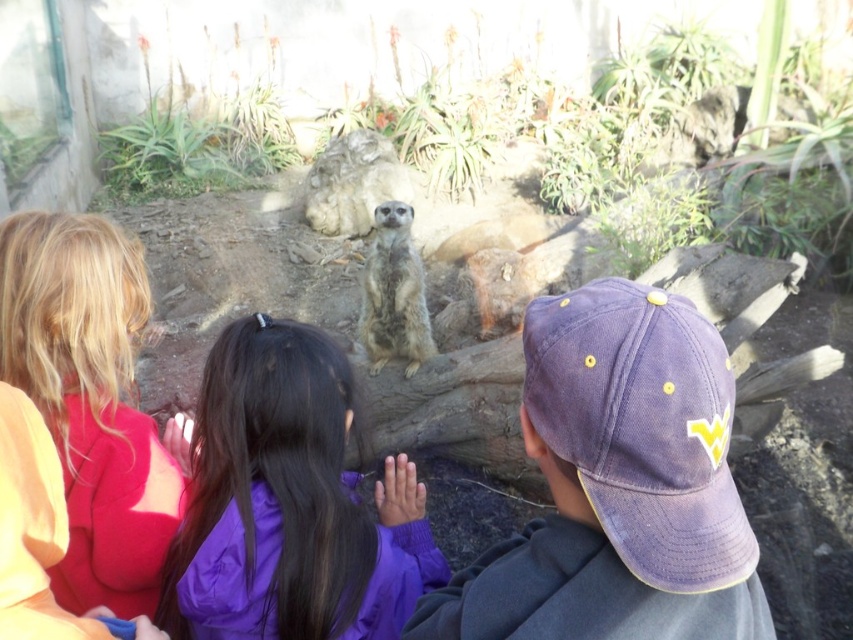
Is purple fabric at center to the left of purple cotton baseball cap at center from the viewer's perspective?

Correct, you'll find purple fabric at center to the left of purple cotton baseball cap at center.

From the picture: Is purple fabric at center smaller than purple cotton baseball cap at center?

No.

In the scene shown: Who is more distant from viewer, (247, 560) or (583, 289)?

The point (247, 560) is behind.

Identify the location of purple fabric at center. This screenshot has height=640, width=853. (289, 502).

Can you confirm if purple fabric at center is positioned above light brown fur meerkat at center?

No, purple fabric at center is not above light brown fur meerkat at center.

Which is more to the right, purple fabric at center or light brown fur meerkat at center?

Positioned to the right is light brown fur meerkat at center.

Find the location of a particular element. purple fabric at center is located at coordinates (289, 502).

Who is higher up, purple cotton baseball cap at center or light brown fur meerkat at center?

light brown fur meerkat at center is above.

Is the position of purple cotton baseball cap at center more distant than that of light brown fur meerkat at center?

That is False.

In order to click on purple cotton baseball cap at center in this screenshot , I will do coord(642,428).

What are the coordinates of `purple cotton baseball cap at center` in the screenshot? It's located at (642, 428).